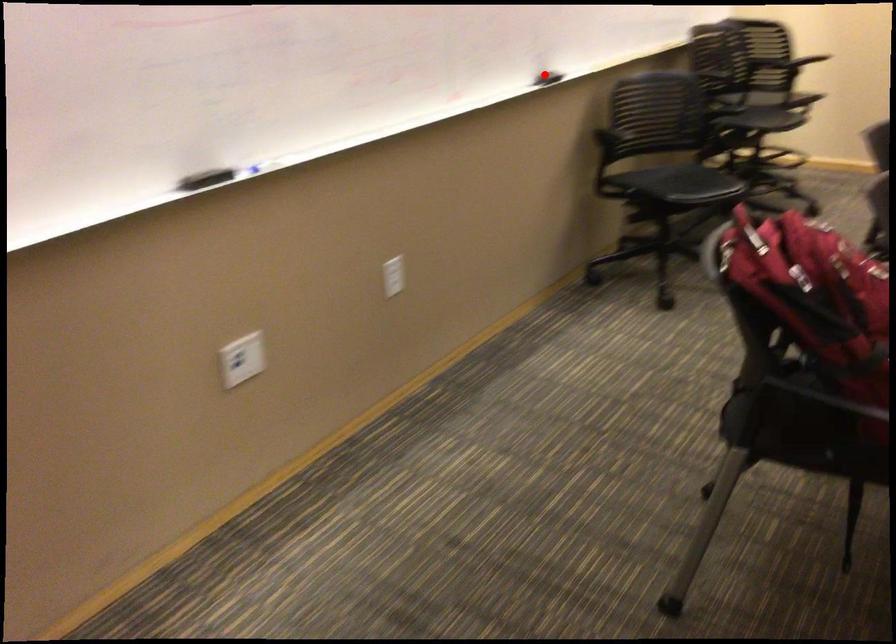
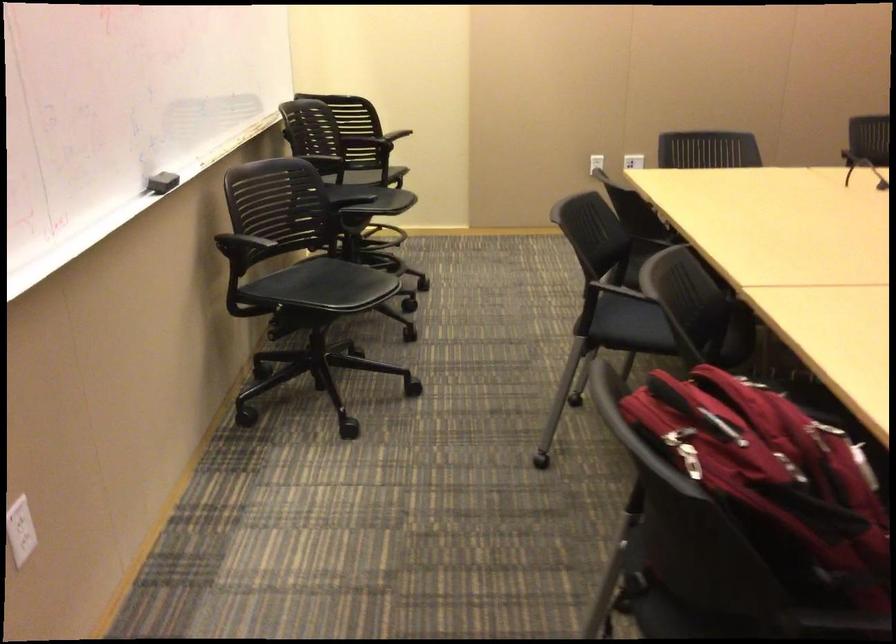
Locate, in the second image, the point that corresponds to the highlighted location in the first image.

(161, 182)